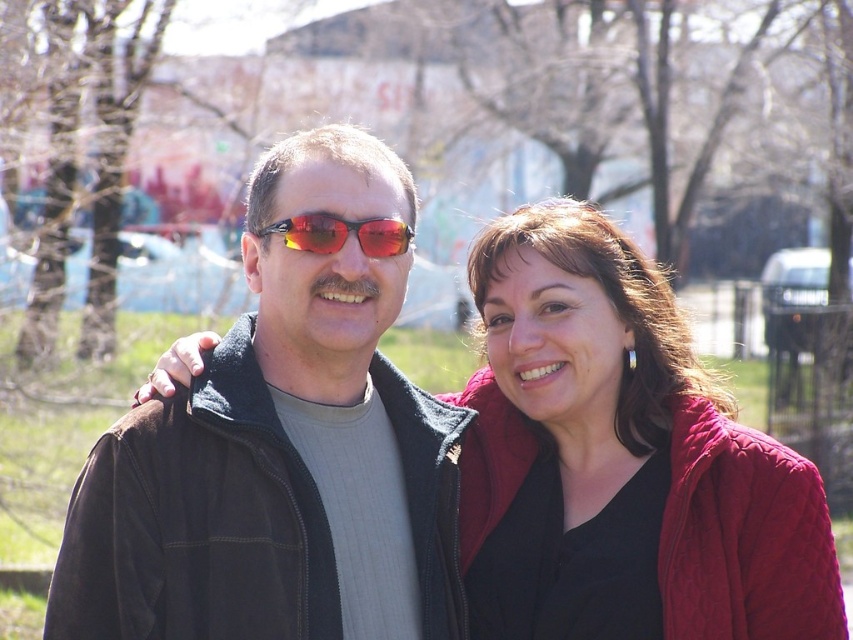
Question: Which point is farther from the camera taking this photo?

Choices:
 (A) (300, 218)
 (B) (310, 445)
 (C) (691, 618)

Answer: (B)

Question: Does matte black jacket at center have a larger size compared to shiny red plastic sunglasses at center?

Choices:
 (A) no
 (B) yes

Answer: (B)

Question: Is matte black jacket at center smaller than quilted red jacket at center?

Choices:
 (A) no
 (B) yes

Answer: (B)

Question: Which object is the closest to the matte black jacket at center?

Choices:
 (A) quilted red jacket at center
 (B) shiny red plastic sunglasses at center

Answer: (B)

Question: Which object is positioned farthest from the matte black jacket at center?

Choices:
 (A) quilted red jacket at center
 (B) shiny red plastic sunglasses at center

Answer: (A)

Question: Can you confirm if matte black jacket at center is smaller than shiny red plastic sunglasses at center?

Choices:
 (A) no
 (B) yes

Answer: (A)